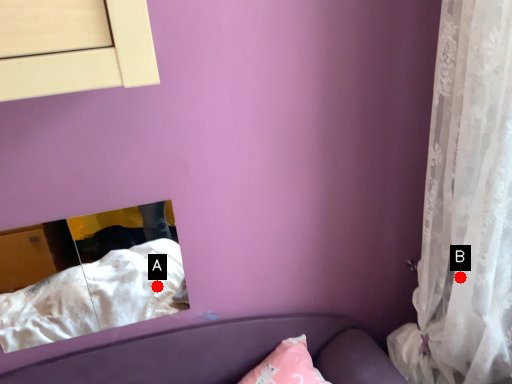
Question: Two points are circled on the image, labeled by A and B beside each circle. Which point is closer to the camera?

Choices:
 (A) A is closer
 (B) B is closer

Answer: (B)